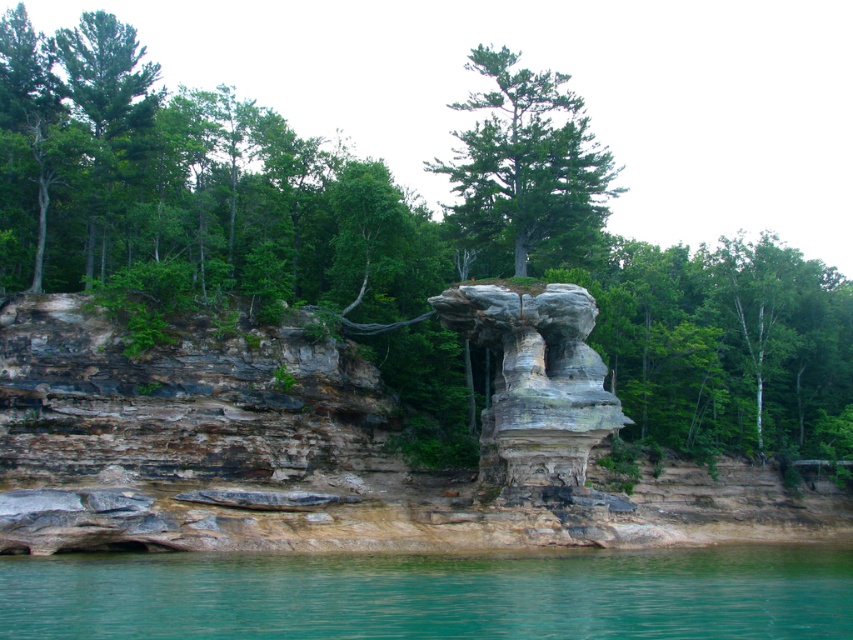
Question: Is green leafy tree at center positioned behind teal water at lower center?

Choices:
 (A) no
 (B) yes

Answer: (B)

Question: Which of the following is the closest to the observer?

Choices:
 (A) (451, 563)
 (B) (576, 147)
 (C) (610, 401)

Answer: (A)

Question: Can you confirm if green leafy tree at center is wider than teal water at lower center?

Choices:
 (A) no
 (B) yes

Answer: (B)

Question: Which of the following is the farthest from the observer?

Choices:
 (A) green matte tree at center
 (B) teal water at lower center
 (C) green leafy tree at center

Answer: (A)

Question: Which point appears closest to the camera in this image?

Choices:
 (A) (770, 563)
 (B) (193, 180)
 (C) (569, 483)
 (D) (556, 129)

Answer: (A)

Question: Is teal water at lower center positioned in front of green matte tree at center?

Choices:
 (A) yes
 (B) no

Answer: (A)